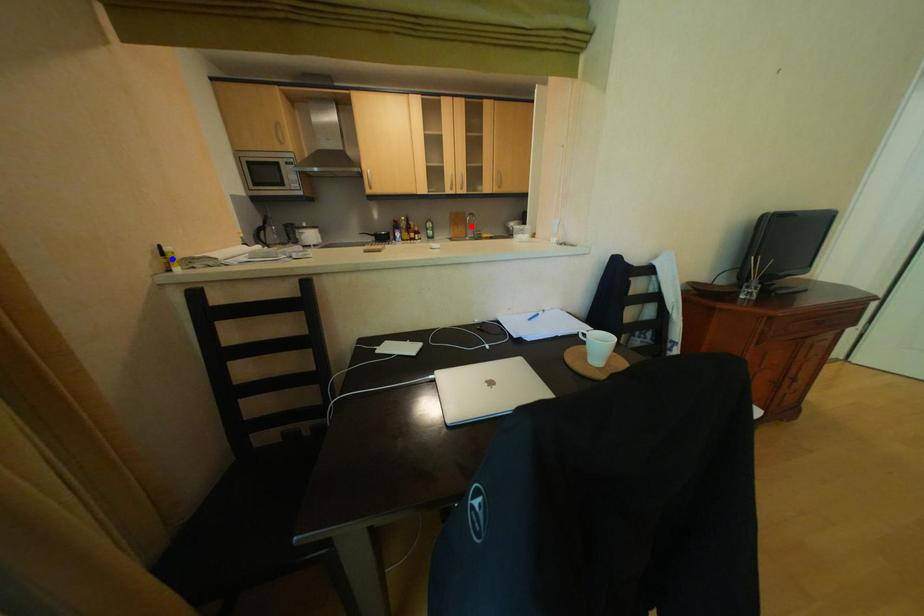
Question: Two points are marked on the image. Which point is closer to the camera?

Choices:
 (A) Blue point is closer.
 (B) Red point is closer.

Answer: (A)